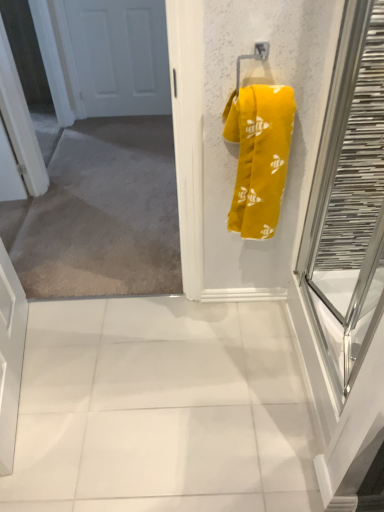
Question: Would you say white glossy tile at center is outside white matte door at upper left?

Choices:
 (A) no
 (B) yes

Answer: (B)

Question: Can you confirm if white glossy tile at center is bigger than white matte door at upper left?

Choices:
 (A) no
 (B) yes

Answer: (B)

Question: Is white glossy tile at center not close to white matte door at upper left?

Choices:
 (A) yes
 (B) no

Answer: (A)

Question: Is white glossy tile at center further to the viewer compared to white matte door at upper left?

Choices:
 (A) yes
 (B) no

Answer: (B)

Question: Does white glossy tile at center have a smaller size compared to white matte door at upper left?

Choices:
 (A) yes
 (B) no

Answer: (B)

Question: Considering the relative positions of white matte door at upper left and clear glass door at right in the image provided, is white matte door at upper left to the left or to the right of clear glass door at right?

Choices:
 (A) left
 (B) right

Answer: (A)

Question: Based on their sizes in the image, would you say white matte door at upper left is bigger or smaller than clear glass door at right?

Choices:
 (A) big
 (B) small

Answer: (B)

Question: Considering the positions of point (86, 89) and point (372, 157), is point (86, 89) closer or farther from the camera than point (372, 157)?

Choices:
 (A) closer
 (B) farther

Answer: (B)

Question: Is white matte door at upper left spatially inside clear glass door at right, or outside of it?

Choices:
 (A) inside
 (B) outside

Answer: (B)

Question: Considering the positions of white glossy tile at center and yellow fabric towel at upper right in the image, is white glossy tile at center wider or thinner than yellow fabric towel at upper right?

Choices:
 (A) wide
 (B) thin

Answer: (A)

Question: In terms of height, does white glossy tile at center look taller or shorter compared to yellow fabric towel at upper right?

Choices:
 (A) tall
 (B) short

Answer: (B)

Question: From the image's perspective, is white glossy tile at center positioned above or below yellow fabric towel at upper right?

Choices:
 (A) below
 (B) above

Answer: (A)

Question: In the image, is white glossy tile at center on the left side or the right side of yellow fabric towel at upper right?

Choices:
 (A) left
 (B) right

Answer: (A)

Question: Looking at the image, does white matte door at upper left seem bigger or smaller compared to white glossy tile at center?

Choices:
 (A) small
 (B) big

Answer: (A)

Question: Is white matte door at upper left wider or thinner than white glossy tile at center?

Choices:
 (A) thin
 (B) wide

Answer: (A)